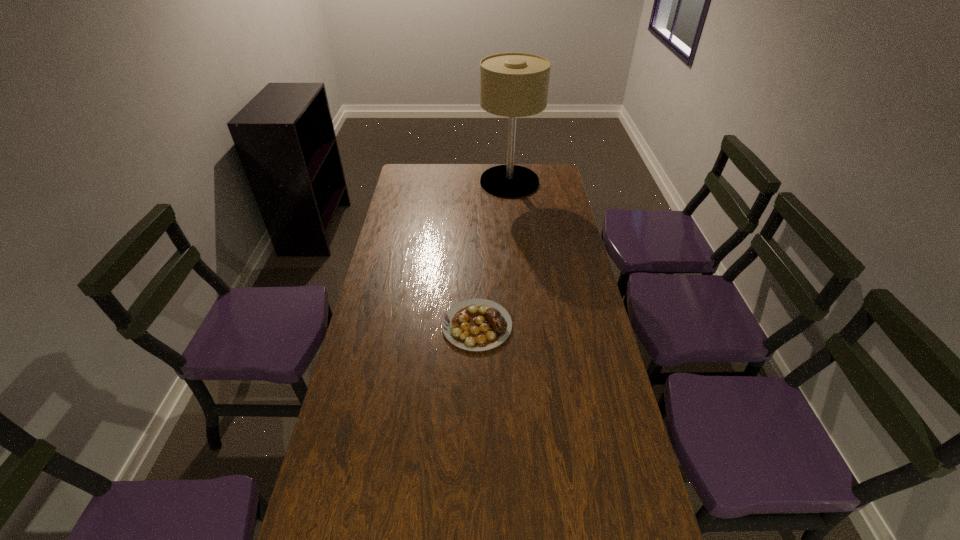
Locate an element on the screen. free space at the right edge of the desktop is located at coordinates (551, 217).

Find the location of a particular element. This screenshot has width=960, height=540. vacant point at the far right corner is located at coordinates (531, 165).

The image size is (960, 540). I want to click on vacant space that is in between the steak and the table lamp, so click(493, 254).

The image size is (960, 540). What are the coordinates of `vacant space in between the table lamp and the shorter object` in the screenshot? It's located at (493, 254).

Locate an element on the screen. This screenshot has height=540, width=960. free space between the table lamp and the shorter object is located at coordinates (493, 254).

Where is `vacant position in the image that satisfies the following two spatial constraints: 1. on the back side of the shorter object; 2. on the right side of the taller object`? The image size is (960, 540). vacant position in the image that satisfies the following two spatial constraints: 1. on the back side of the shorter object; 2. on the right side of the taller object is located at coordinates (478, 182).

The height and width of the screenshot is (540, 960). I want to click on free space that satisfies the following two spatial constraints: 1. on the back side of the farther object; 2. on the right side of the nearer object, so click(478, 182).